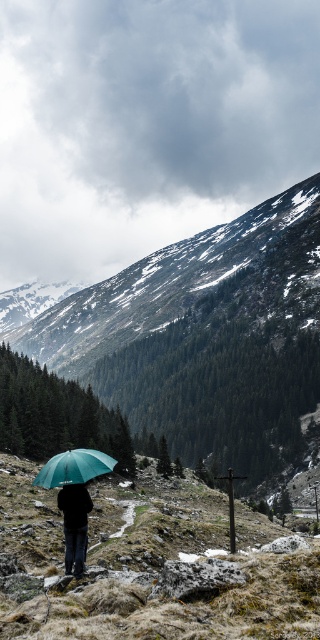
Is dark green umbrella at center above green matte umbrella at lower left?

Incorrect, dark green umbrella at center is not positioned above green matte umbrella at lower left.

Who is more forward, (x=80, y=509) or (x=79, y=477)?

Point (x=80, y=509) is more forward.

Describe the element at coordinates (74, 524) in the screenshot. This screenshot has width=320, height=640. I see `dark green umbrella at center` at that location.

Image resolution: width=320 pixels, height=640 pixels. I want to click on dark green umbrella at center, so click(x=74, y=524).

Between snowy rocky mountain at center and dark green umbrella at center, which one is positioned higher?

snowy rocky mountain at center

Does point (142, 285) lie in front of point (80, 529)?

No, (142, 285) is behind (80, 529).

The image size is (320, 640). Identify the location of snowy rocky mountain at center. (205, 337).

From the picture: Is snowy rocky mountain at center to the right of green matte umbrella at lower left from the viewer's perspective?

Indeed, snowy rocky mountain at center is positioned on the right side of green matte umbrella at lower left.

Is snowy rocky mountain at center taller than green matte umbrella at lower left?

Yes, snowy rocky mountain at center is taller than green matte umbrella at lower left.

Which is in front, point (98, 320) or point (87, 451)?

Point (87, 451) is in front.

Identify the location of snowy rocky mountain at center. (205, 337).